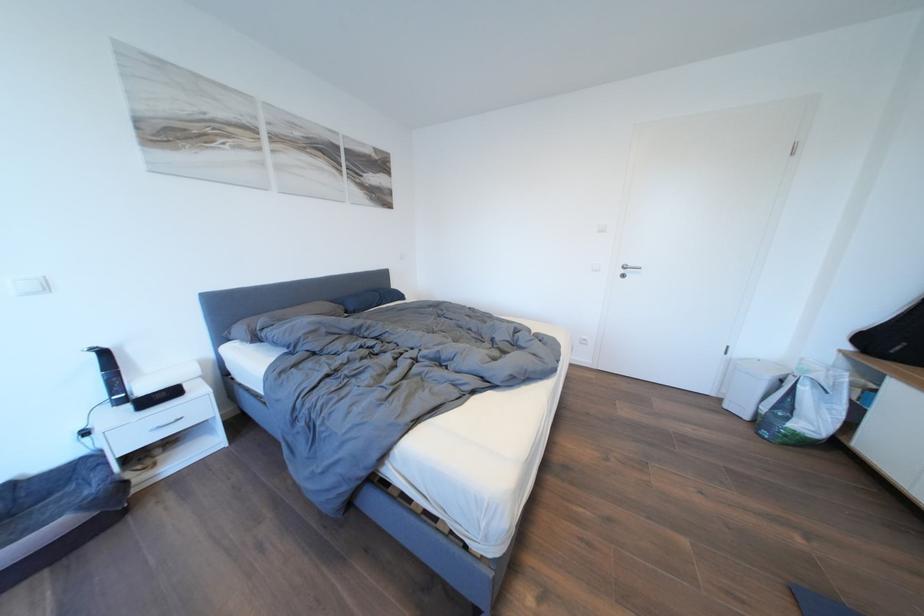
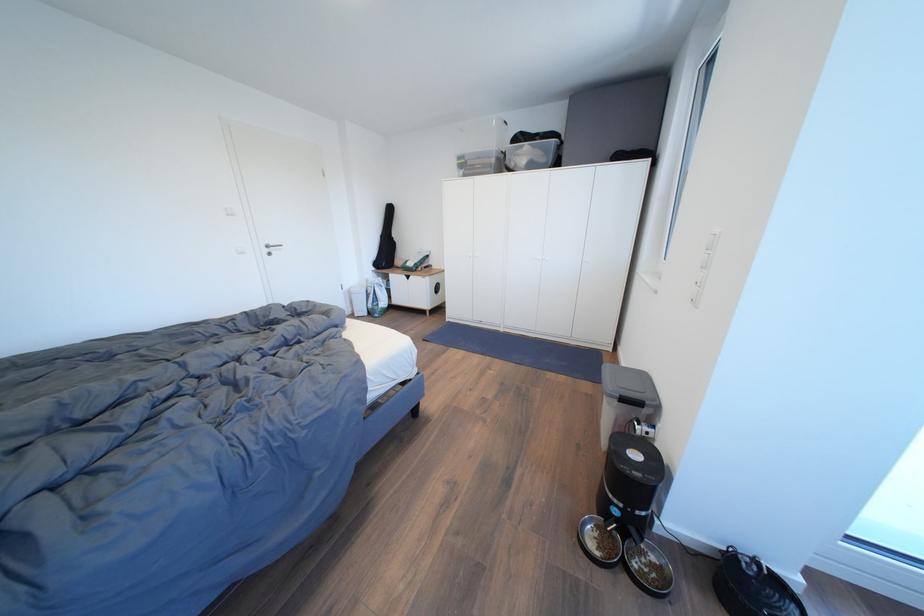
Locate, in the second image, the point that corresponds to (638,270) in the first image.

(280, 249)